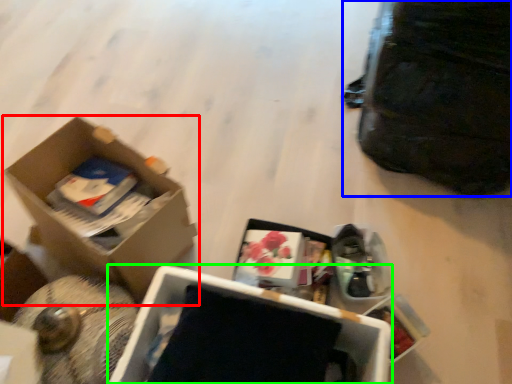
Question: Which is farther away from box (highlighted by a red box)? bag (highlighted by a blue box) or box (highlighted by a green box)?

Choices:
 (A) bag
 (B) box

Answer: (A)